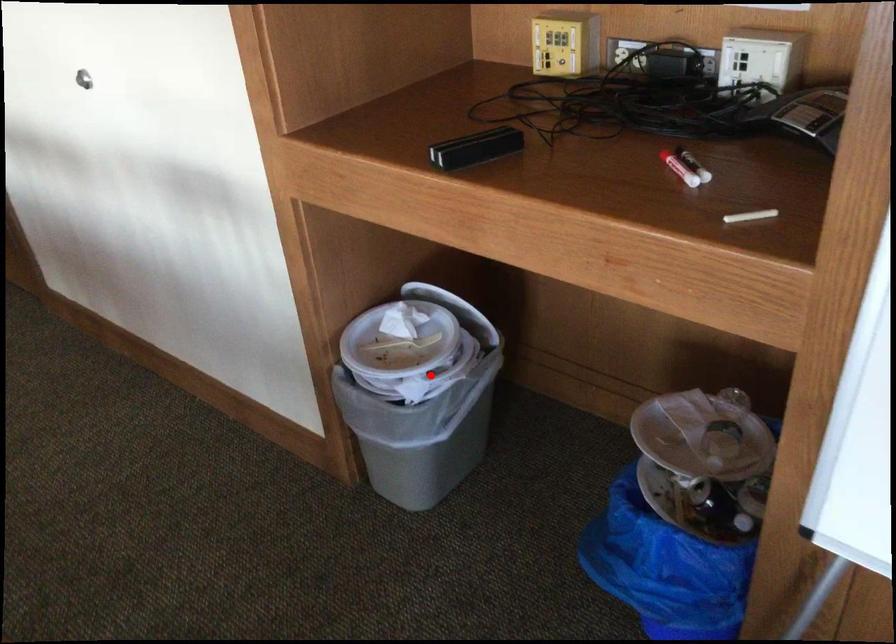
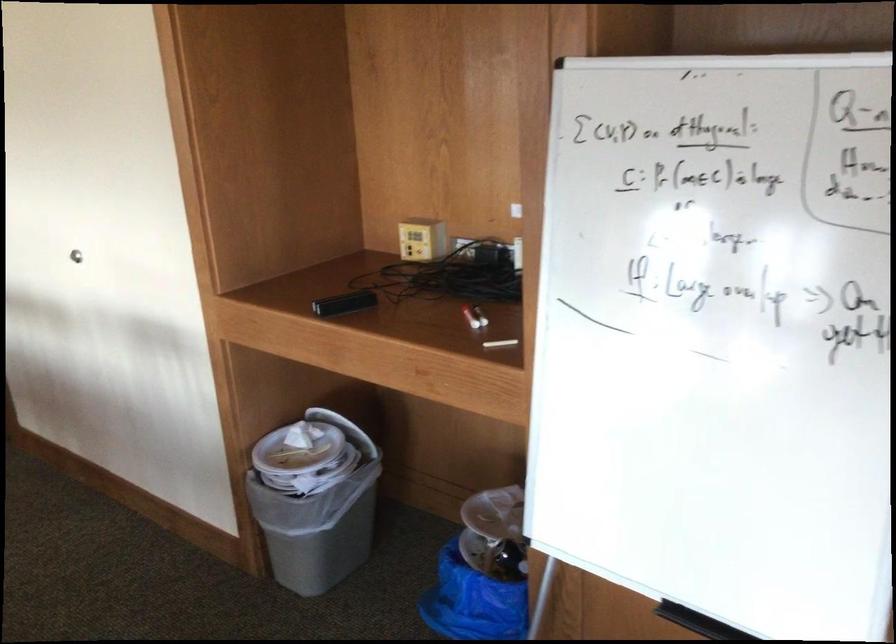
Question: I am providing you with two images of the same scene from different viewpoints. In image1, a red point is highlighted. Considering the same 3D point in image2, which of the following is correct?

Choices:
 (A) It is closer
 (B) It is farther

Answer: (B)